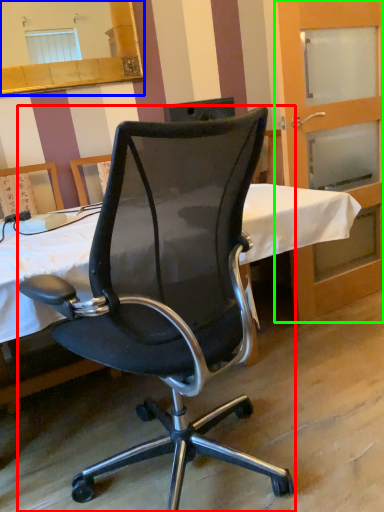
Question: Which object is the closest to the chair (highlighted by a red box)? Choose among these: mirror (highlighted by a blue box) or screen door (highlighted by a green box).

Choices:
 (A) mirror
 (B) screen door

Answer: (B)